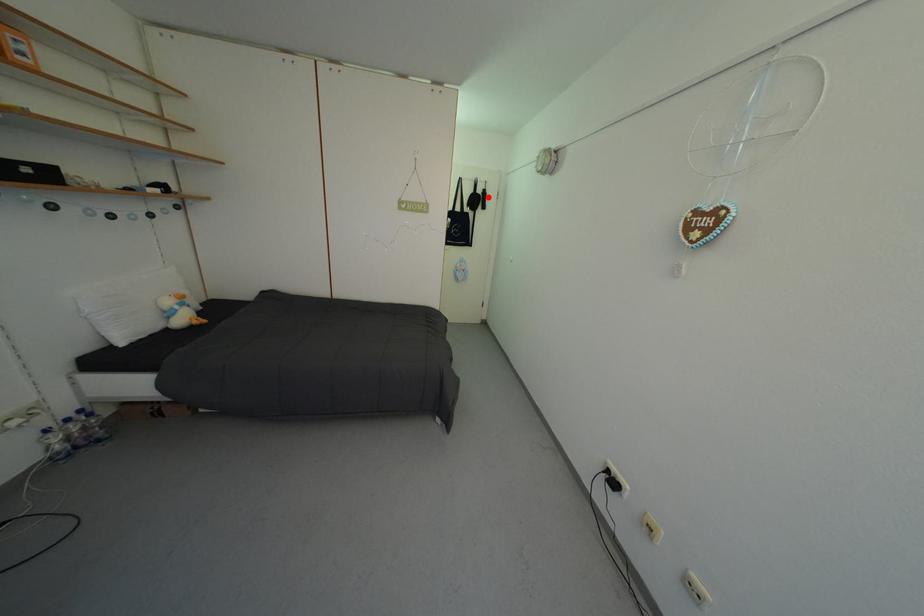
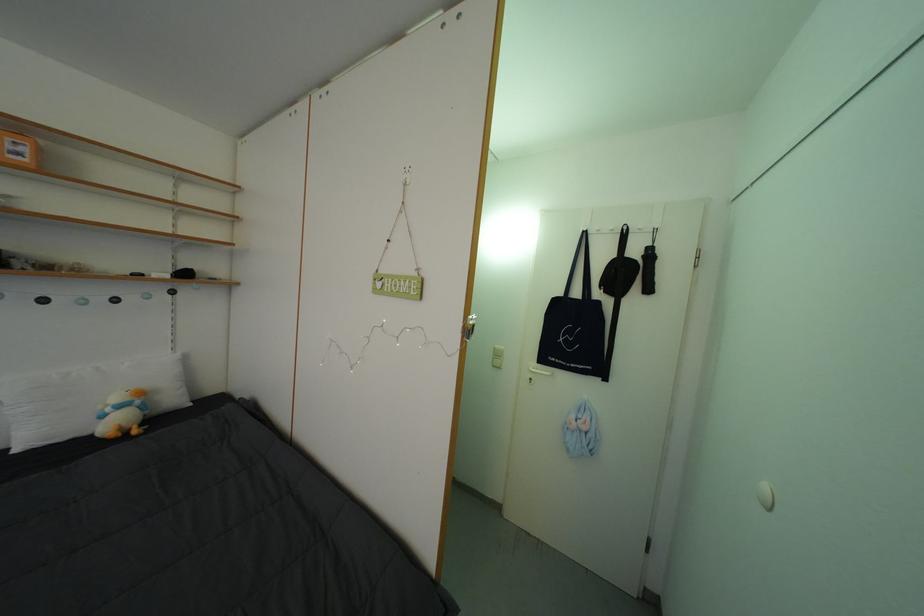
In the second image, find the point that corresponds to the highlighted location in the first image.

(642, 257)